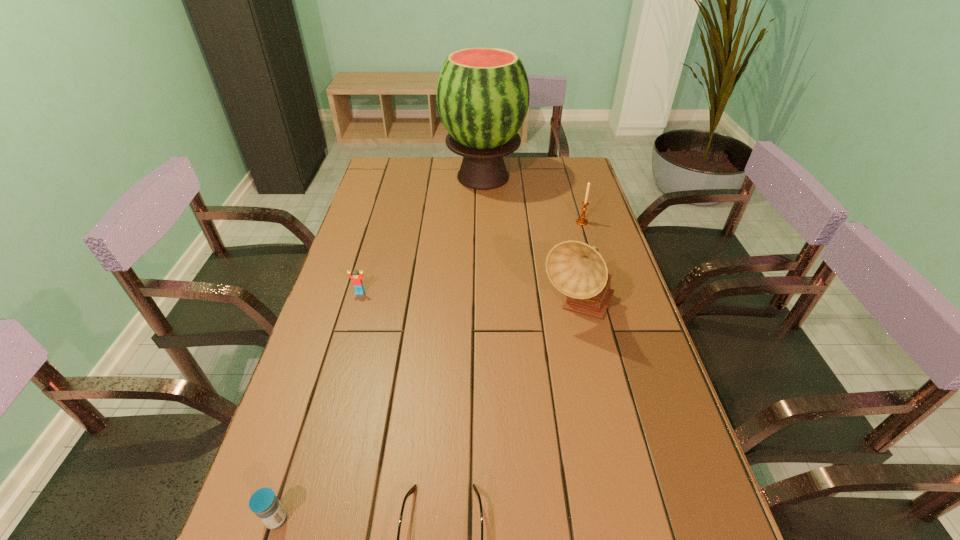
Locate an element on the screen. The width and height of the screenshot is (960, 540). blank area at the far left corner is located at coordinates (404, 174).

In the image, there is a desktop. At what (x,y) coordinates should I click in order to perform the action: click on vacant space at the far right corner. Please return your answer as a coordinate pair (x, y). The image size is (960, 540). Looking at the image, I should click on (556, 166).

Where is `free space between the second farthest object and the farthest object`? The height and width of the screenshot is (540, 960). free space between the second farthest object and the farthest object is located at coordinates (533, 199).

This screenshot has height=540, width=960. I want to click on vacant area between the Lego and the medicine, so click(319, 406).

This screenshot has height=540, width=960. I want to click on free space that is in between the medicine and the third tallest object, so click(x=429, y=370).

Find the location of a particular element. Image resolution: width=960 pixels, height=540 pixels. vacant space that is in between the medicine and the fifth shortest object is located at coordinates (427, 414).

You are a GUI agent. You are given a task and a screenshot of the screen. Output one action in this format:
    pyautogui.click(x=<x>, y=<y>)
    Task: Click on the free area in between the watermelon and the fifth shortest object
    
    Given the screenshot: What is the action you would take?
    pos(530,243)

Locate an element on the screen. Image resolution: width=960 pixels, height=540 pixels. unoccupied position between the watermelon and the medicine is located at coordinates pyautogui.click(x=379, y=348).

Find the location of a particular element. Image resolution: width=960 pixels, height=540 pixels. the fourth closest object to the fifth nearest object is located at coordinates (411, 491).

Find the location of `the fourth closest object to the medicine`. the fourth closest object to the medicine is located at coordinates (483, 94).